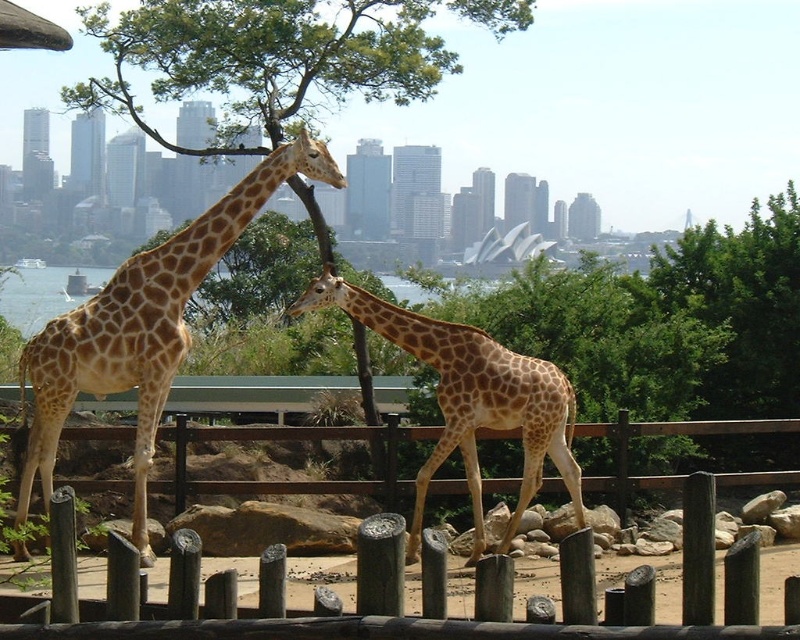
Question: Is golden-brown spotted giraffe at center to the right of spotted fur giraffe at center from the viewer's perspective?

Choices:
 (A) yes
 (B) no

Answer: (B)

Question: Which of the following is the closest to the observer?

Choices:
 (A) wooden post fence at center
 (B) spotted fur giraffe at center
 (C) golden-brown spotted giraffe at center

Answer: (A)

Question: Among these points, which one is nearest to the camera?

Choices:
 (A) (498, 600)
 (B) (94, 385)
 (C) (496, 365)

Answer: (A)

Question: Is golden-brown spotted giraffe at center bigger than spotted fur giraffe at center?

Choices:
 (A) no
 (B) yes

Answer: (A)

Question: Can you confirm if golden-brown spotted giraffe at center is thinner than spotted fur giraffe at center?

Choices:
 (A) yes
 (B) no

Answer: (A)

Question: Considering the real-world distances, which object is closest to the spotted fur giraffe at center?

Choices:
 (A) wooden post fence at center
 (B) golden-brown spotted giraffe at center

Answer: (B)